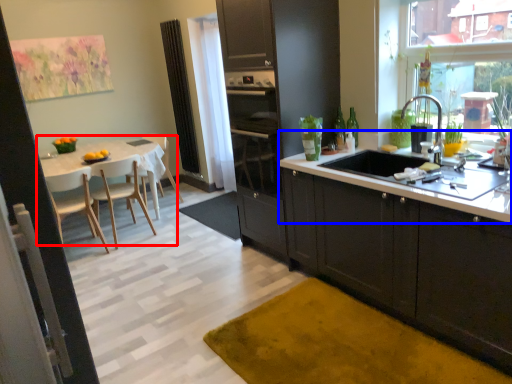
Question: Among these objects, which one is farthest to the camera, kitchen & dining room table (highlighted by a red box) or countertop (highlighted by a blue box)?

Choices:
 (A) kitchen & dining room table
 (B) countertop

Answer: (A)